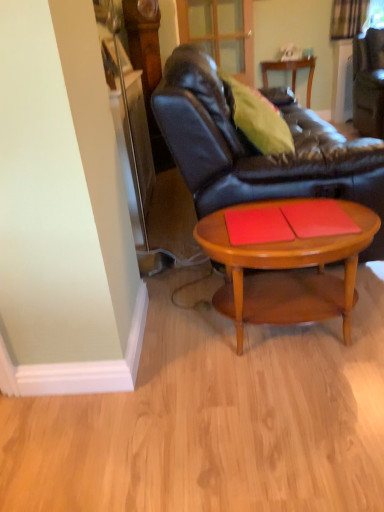
Where is `vacant space underneath red matte book at center, which ranks as the 2th plank in right-to-left order (from a real-world perspective)`? vacant space underneath red matte book at center, which ranks as the 2th plank in right-to-left order (from a real-world perspective) is located at coordinates (249, 225).